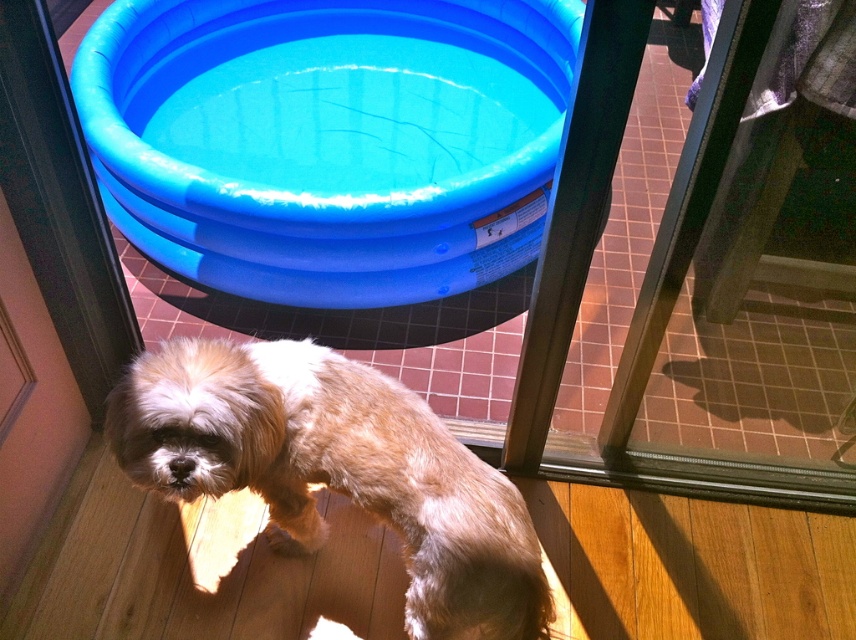
Can you confirm if blue rubber pool at upper center is smaller than transparent glass door at center?

Incorrect, blue rubber pool at upper center is not smaller in size than transparent glass door at center.

Is point (140, 8) positioned in front of point (627, 362)?

No, (140, 8) is further to viewer.

The image size is (856, 640). In order to click on blue rubber pool at upper center in this screenshot , I will do `click(328, 140)`.

Can you confirm if golden fur dog at center is smaller than transparent glass door at center?

Yes, golden fur dog at center is smaller than transparent glass door at center.

Where is `golden fur dog at center`? This screenshot has width=856, height=640. golden fur dog at center is located at coordinates (336, 470).

Locate an element on the screen. The height and width of the screenshot is (640, 856). golden fur dog at center is located at coordinates (336, 470).

Between point (311, 67) and point (207, 467), which one is positioned in front?

Positioned in front is point (207, 467).

Does blue rubber pool at upper center have a lesser height compared to golden fur dog at center?

In fact, blue rubber pool at upper center may be taller than golden fur dog at center.

Is point (409, 173) less distant than point (399, 387)?

That is False.

At what (x,y) coordinates should I click in order to perform the action: click on blue rubber pool at upper center. Please return your answer as a coordinate pair (x, y). The width and height of the screenshot is (856, 640). Looking at the image, I should click on (328, 140).